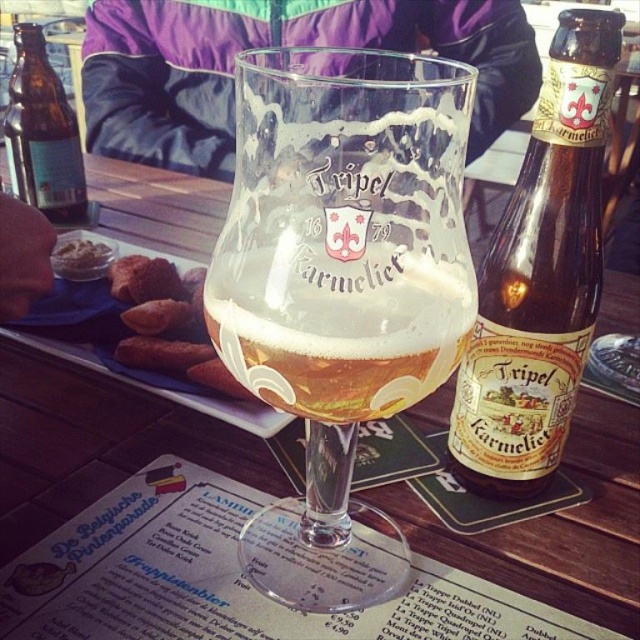
Question: Which object appears farthest from the camera in this image?

Choices:
 (A) brown glass bottle at center-right
 (B) clear glass beer glass at center
 (C) translucent glass beer at center
 (D) brown glass bottle at left

Answer: (D)

Question: From the image, what is the correct spatial relationship of clear glass beer glass at center in relation to brown glass bottle at left?

Choices:
 (A) left
 (B) right

Answer: (B)

Question: Is clear glass beer glass at center positioned before translucent glass beer at center?

Choices:
 (A) no
 (B) yes

Answer: (B)

Question: Which of these objects is positioned farthest from the clear glass beer glass at center?

Choices:
 (A) brown glass bottle at left
 (B) brown glass bottle at center-right
 (C) translucent glass beer at center

Answer: (A)

Question: Estimate the real-world distances between objects in this image. Which object is farther from the brown glass bottle at center-right?

Choices:
 (A) brown glass bottle at left
 (B) translucent glass beer at center

Answer: (A)

Question: From the image, what is the correct spatial relationship of translucent glass beer at center in relation to brown glass bottle at left?

Choices:
 (A) right
 (B) left

Answer: (A)